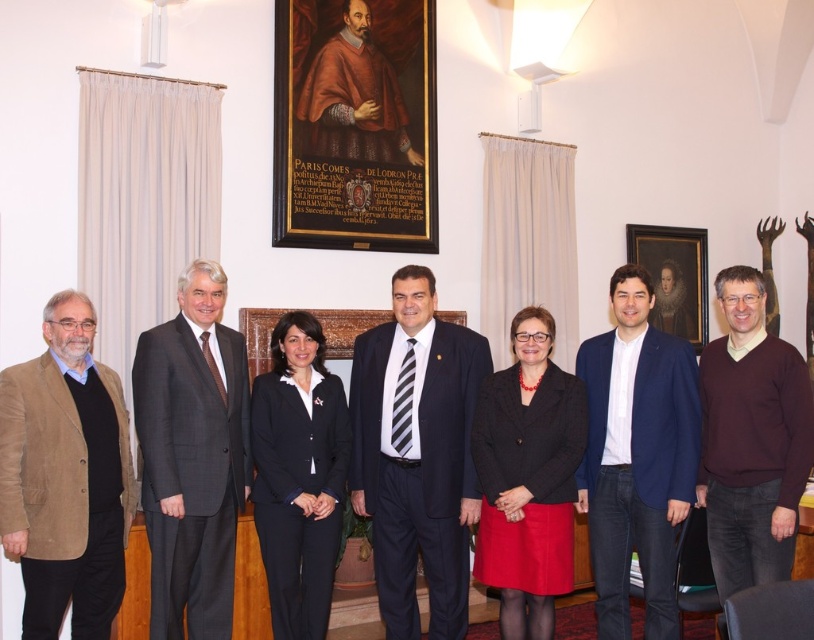
Is dark blue suit at center positioned at the back of maroon sweater at center?

That is True.

Looking at this image, measure the distance between dark blue suit at center and maroon sweater at center.

dark blue suit at center and maroon sweater at center are 4.93 feet apart from each other.

You are a GUI agent. You are given a task and a screenshot of the screen. Output one action in this format:
    pyautogui.click(x=<x>, y=<y>)
    Task: Click on the dark blue suit at center
    This screenshot has width=814, height=640.
    Given the screenshot: What is the action you would take?
    pyautogui.click(x=416, y=454)

This screenshot has height=640, width=814. I want to click on dark blue suit at center, so click(416, 454).

Is gold-framed portrait at upper center wider than maroon sweater at center?

Yes.

Can you confirm if gold-framed portrait at upper center is positioned to the left of maroon sweater at center?

Correct, you'll find gold-framed portrait at upper center to the left of maroon sweater at center.

Is point (333, 208) positioned before point (756, 554)?

That is False.

The image size is (814, 640). I want to click on gold-framed portrait at upper center, so click(355, 124).

Between dark gray suit at center and maroon sweater at center, which one is positioned lower?

dark gray suit at center is below.

Is point (168, 515) farther from viewer compared to point (729, 419)?

That is False.

Is point (239, 406) positioned behind point (791, 392)?

Yes, it is behind point (791, 392).

Image resolution: width=814 pixels, height=640 pixels. I want to click on dark gray suit at center, so click(x=191, y=456).